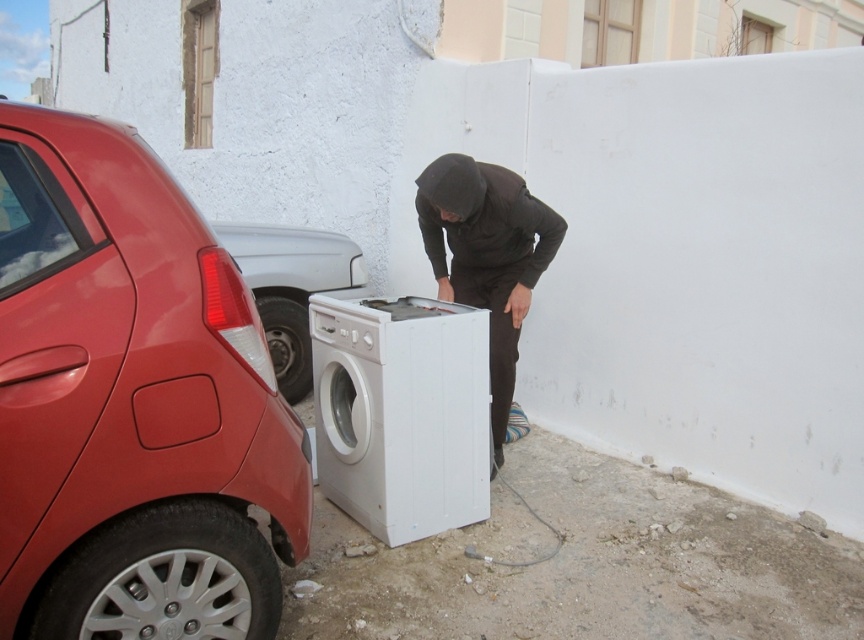
Question: Is glossy red car at left to the right of white plastic washing machine at lower center from the viewer's perspective?

Choices:
 (A) no
 (B) yes

Answer: (A)

Question: Can you confirm if dark brown hoodie at center is bigger than metallic red car at left?

Choices:
 (A) yes
 (B) no

Answer: (B)

Question: Estimate the real-world distances between objects in this image. Which object is farther from the metallic red car at left?

Choices:
 (A) glossy red car at left
 (B) dark brown hoodie at center
 (C) white plastic washing machine at lower center

Answer: (A)

Question: Which point is closer to the camera?

Choices:
 (A) glossy red car at left
 (B) dark brown hoodie at center

Answer: (A)

Question: Which point is farther from the camera taking this photo?

Choices:
 (A) (370, 504)
 (B) (144, 560)
 (C) (284, 323)

Answer: (C)

Question: Does white plastic washing machine at lower center appear under metallic red car at left?

Choices:
 (A) yes
 (B) no

Answer: (A)